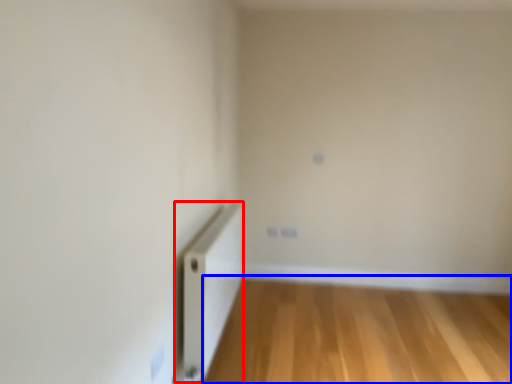
Question: Which point is further to the camera, radiator (highlighted by a red box) or corridor (highlighted by a blue box)?

Choices:
 (A) radiator
 (B) corridor

Answer: (B)